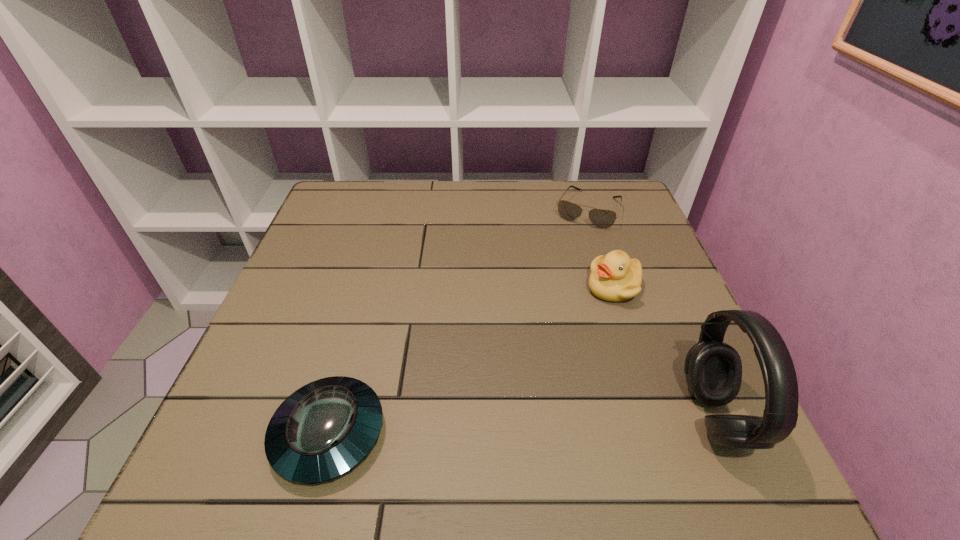
Where is `unoccupied position between the saucer and the farthest object`? unoccupied position between the saucer and the farthest object is located at coordinates (458, 321).

Locate an element on the screen. unoccupied area between the headset and the duckling is located at coordinates (664, 352).

Image resolution: width=960 pixels, height=540 pixels. I want to click on empty space that is in between the tallest object and the second farthest object, so click(664, 352).

Image resolution: width=960 pixels, height=540 pixels. I want to click on free space that is in between the sunglasses and the third nearest object, so (600, 248).

You are a GUI agent. You are given a task and a screenshot of the screen. Output one action in this format:
    pyautogui.click(x=<x>, y=<y>)
    Task: Click on the vacant area between the farthest object and the duckling
    This screenshot has width=960, height=540.
    Given the screenshot: What is the action you would take?
    pyautogui.click(x=600, y=248)

This screenshot has width=960, height=540. Identify the location of free space between the leftmost object and the second tallest object. (471, 361).

At what (x,y) coordinates should I click in order to perform the action: click on vacant area that lies between the sunglasses and the tallest object. Please return your answer as a coordinate pair (x, y). This screenshot has height=540, width=960. Looking at the image, I should click on [x=651, y=313].

The image size is (960, 540). I want to click on vacant space that is in between the tallest object and the leftmost object, so click(521, 425).

Locate an element on the screen. The height and width of the screenshot is (540, 960). object that stands as the second closest to the headset is located at coordinates (601, 218).

Select which object appears as the third closest to the second farthest object. Please provide its 2D coordinates. Your answer should be formatted as a tuple, i.e. [(x, y)], where the tuple contains the x and y coordinates of a point satisfying the conditions above.

[(323, 430)]